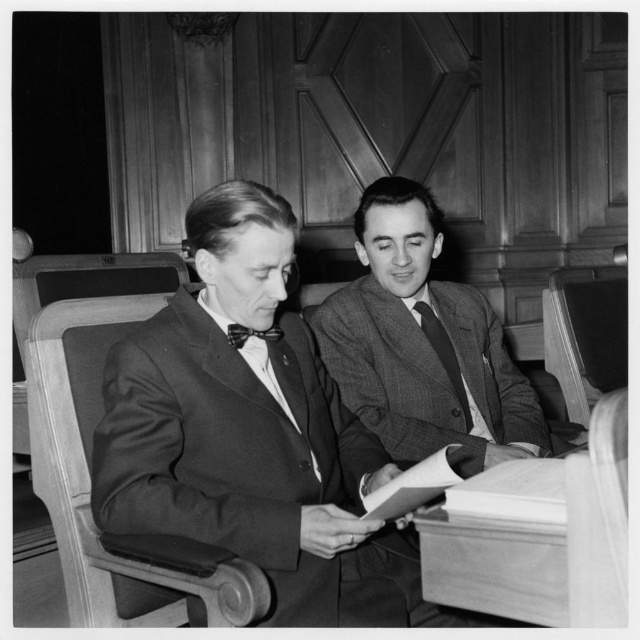
Based on the scene described, which object is wider, the smooth black suit at left or the black textured tie at center?

The smooth black suit at left is wider than the black textured tie at center according to the description.

From the picture: You are an artist trying to draw this scene accurately. You need to place the smooth black suit at left and the black textured tie at center in the correct positions. According to the image, which object is positioned lower in the scene?

The smooth black suit at left is positioned below the black textured tie at center, so it is lower in the scene.

You are an interior designer assessing the space in this courtroom scene. You need to place a decorative item that requires a surface area of 0.5 square meters. Which object from the scene, the wooden chair at left or the black textured tie at center, would be more suitable for placing this item?

The wooden chair at left is bigger than the black textured tie at center, so the wooden chair at left would be more suitable for placing the decorative item requiring 0.5 square meters of surface area.